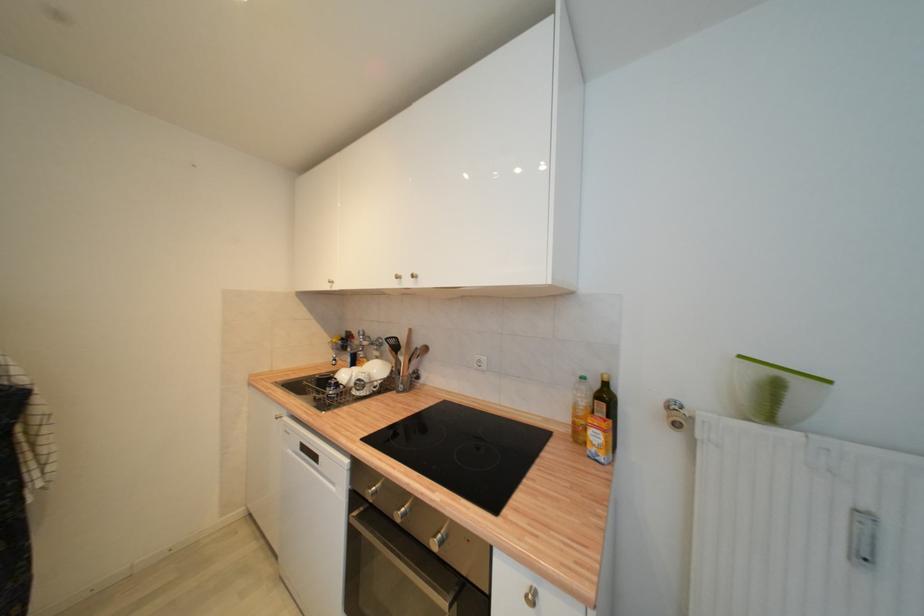
This screenshot has width=924, height=616. What are the coordinates of `oven handle` in the screenshot? It's located at (395, 565).